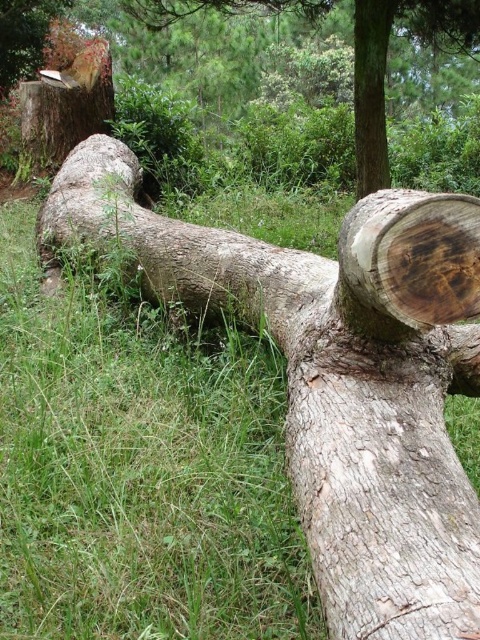
Question: Which of the following is the closest to the observer?

Choices:
 (A) green grass at center
 (B) smooth brown log at center

Answer: (A)

Question: Can you confirm if green grass at center is positioned to the right of smooth brown log at center?

Choices:
 (A) yes
 (B) no

Answer: (B)

Question: Is green grass at center in front of smooth brown log at center?

Choices:
 (A) yes
 (B) no

Answer: (A)

Question: Is green grass at center closer to camera compared to smooth brown log at center?

Choices:
 (A) yes
 (B) no

Answer: (A)